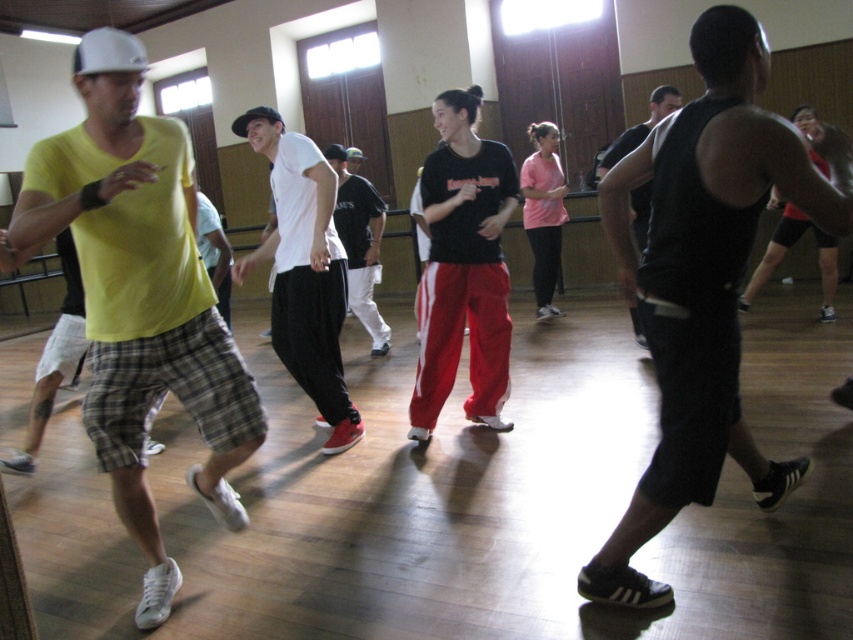
Does black cotton shirt at center appear under black matte tank top at center?

Indeed, black cotton shirt at center is positioned under black matte tank top at center.

In the scene shown: Does black cotton shirt at center have a greater width compared to black matte tank top at center?

Incorrect, black cotton shirt at center's width does not surpass black matte tank top at center's.

Describe the element at coordinates (358, 244) in the screenshot. The width and height of the screenshot is (853, 640). I see `black cotton shirt at center` at that location.

This screenshot has width=853, height=640. I want to click on black cotton shirt at center, so click(358, 244).

Between point (657, 321) and point (268, 236), which one is positioned in front?

Point (657, 321) is more forward.

Which is behind, point (733, 291) or point (297, 284)?

Positioned behind is point (297, 284).

Is point (741, 209) positioned after point (287, 177)?

No, (741, 209) is in front of (287, 177).

Where is `black sleeveless shirt at center`? This screenshot has width=853, height=640. black sleeveless shirt at center is located at coordinates (705, 282).

How much distance is there between white matte t-shirt at center and black cotton shirt at center?

5.57 feet

Does white matte t-shirt at center appear under black cotton shirt at center?

Yes.

Is point (283, 125) farther from camera compared to point (369, 316)?

No, it is not.

The width and height of the screenshot is (853, 640). What are the coordinates of `white matte t-shirt at center` in the screenshot? It's located at coord(305,269).